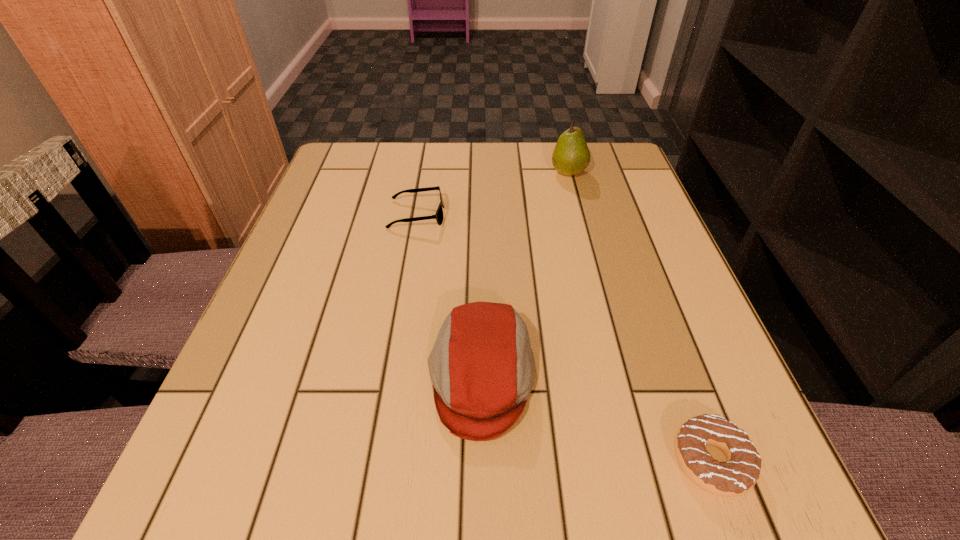
Image resolution: width=960 pixels, height=540 pixels. I want to click on free space that satisfies the following two spatial constraints: 1. on the front-facing side of the sunglasses; 2. on the right side of the doughnut, so click(375, 461).

You are a GUI agent. You are given a task and a screenshot of the screen. Output one action in this format:
    pyautogui.click(x=<x>, y=<y>)
    Task: Click on the vacant space that satisfies the following two spatial constraints: 1. on the front-facing side of the doughnut; 2. on the left side of the second tallest object
    Image resolution: width=960 pixels, height=540 pixels.
    Given the screenshot: What is the action you would take?
    pyautogui.click(x=481, y=461)